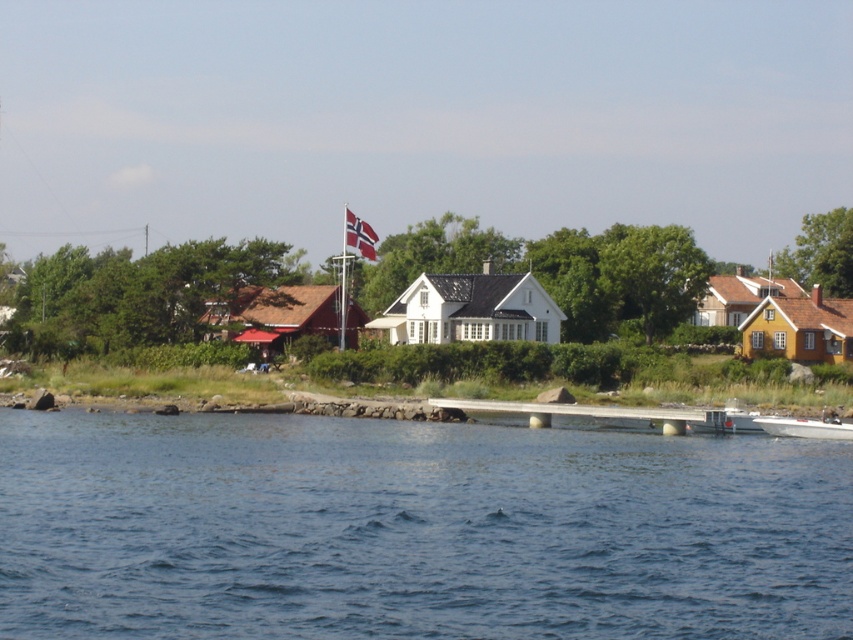
Question: Which point appears closest to the camera in this image?

Choices:
 (A) (49, 540)
 (B) (660, 413)
 (C) (769, 422)
 (D) (364, 241)

Answer: (A)

Question: Estimate the real-world distances between objects in this image. Which object is closer to the white plastic boat at lower right?

Choices:
 (A) smooth concrete dock at center
 (B) blue water at lower center
 (C) white fabric flag at upper center

Answer: (A)

Question: Can you confirm if smooth concrete dock at center is positioned below white plastic boat at lower right?

Choices:
 (A) no
 (B) yes

Answer: (B)

Question: Does blue water at lower center have a greater width compared to white fabric flag at upper center?

Choices:
 (A) no
 (B) yes

Answer: (B)

Question: Which object is the farthest from the white plastic boat at lower right?

Choices:
 (A) white fabric flag at upper center
 (B) blue water at lower center

Answer: (A)

Question: In this image, where is blue water at lower center located relative to smooth concrete dock at center?

Choices:
 (A) left
 (B) right

Answer: (A)